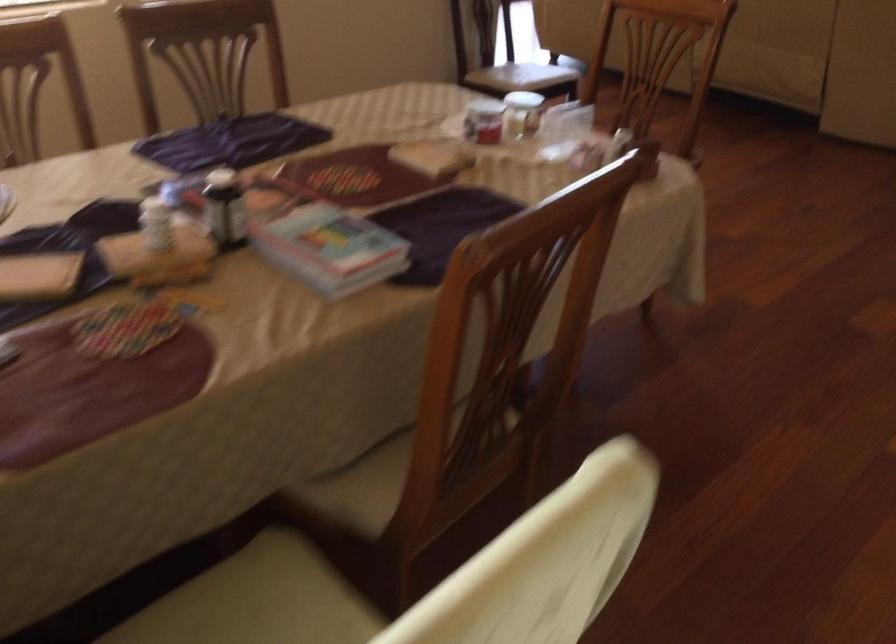
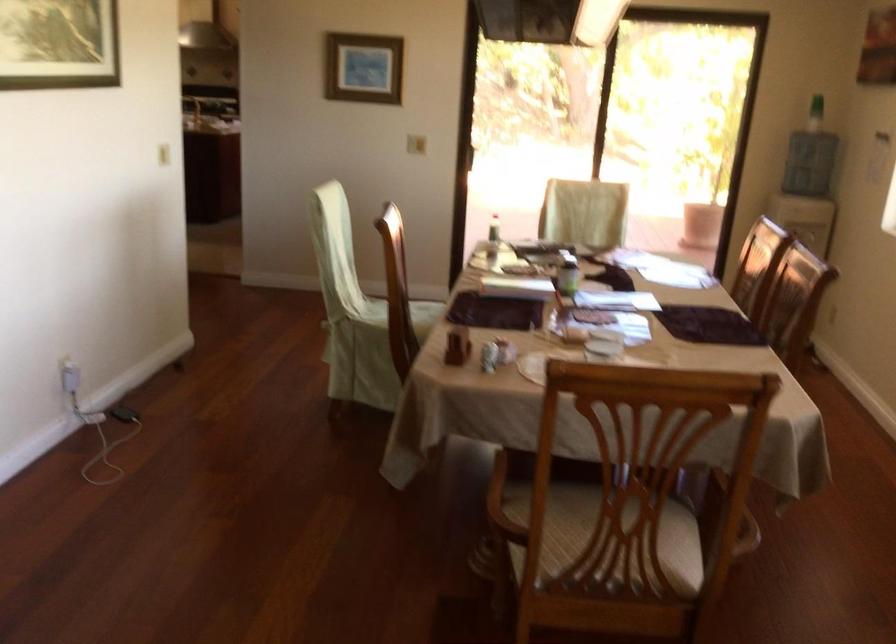
Find the pixel in the second image that matches the point at 643,152 in the first image.

(458, 345)